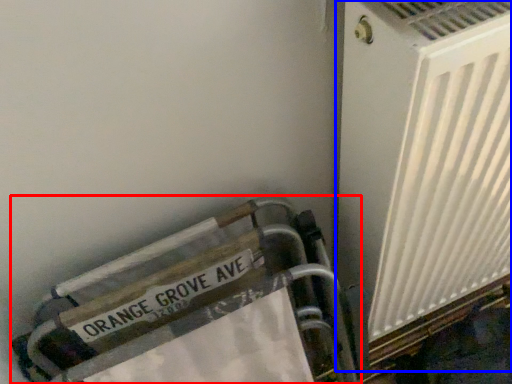
Question: Which of the following is the farthest to the observer, furniture (highlighted by a red box) or air conditioning (highlighted by a blue box)?

Choices:
 (A) furniture
 (B) air conditioning

Answer: (A)